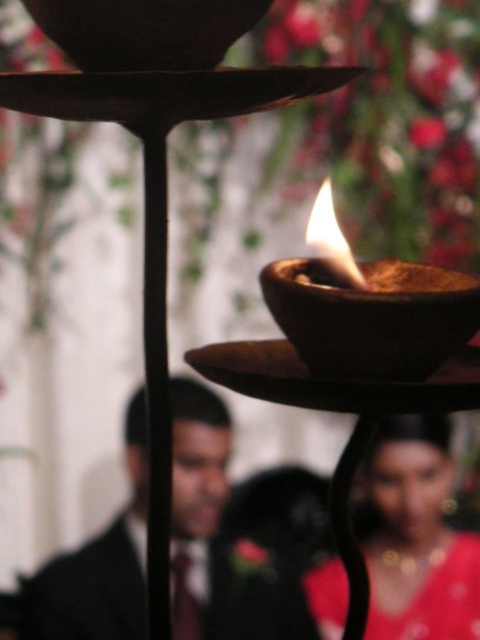
You are standing in a dark room with the traditional oil lamp. You want to place a small candle exactly 2 meters away from where you are standing. Can you use the point marked at coordinates point (422, 515) as a reference to determine if the candle will be placed at the correct distance?

The point marked at coordinates point (422, 515) is 1.53 meters from the viewer. Since you want to place the candle 2 meters away, the distance is insufficient. You need to move further away from the current position to achieve the desired distance of 2 meters.

You are a photographer setting up for a cultural event. You notice a matte red dress at center and a matte brown bowl at center in the scene. Which object should you adjust your camera focus to capture clearly if you want to prioritize the foreground subject?

You should focus on the matte red dress at center because it is in the foreground, while the matte brown bowl at center is behind it.